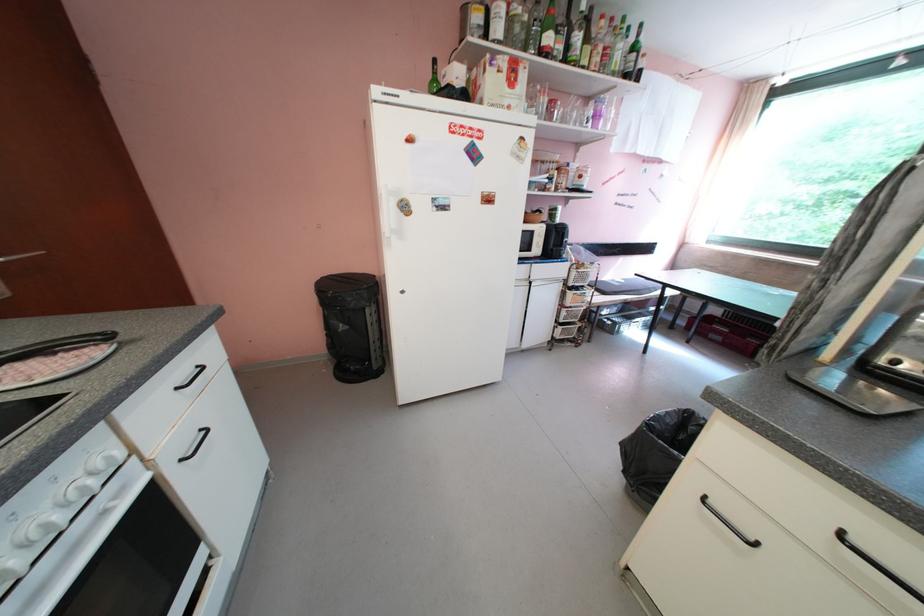
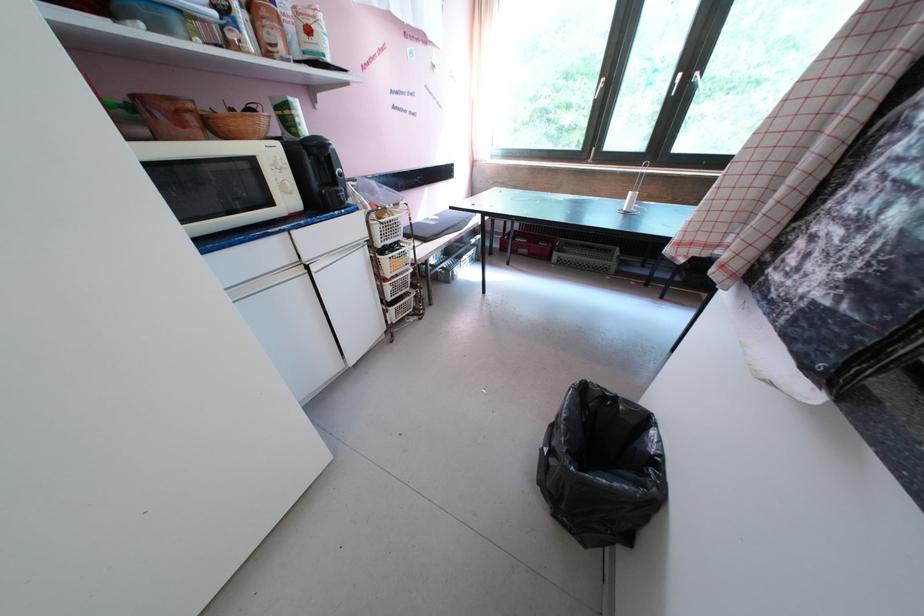
How did the camera likely rotate?

The rotation direction of the camera is right-down.